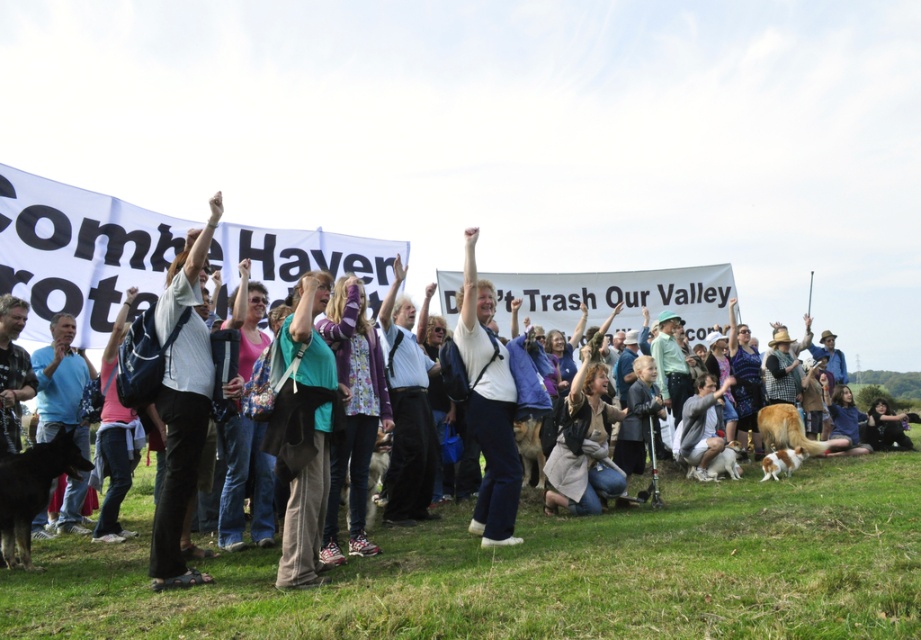
You are a photographer at the protest and need to capture a photo that includes both the light gray cotton shirt at center and the blue cotton shirt at left. Which shirt should you position closer to the camera to ensure both are fully visible in the frame?

You should position the light gray cotton shirt at center closer to the camera because it is narrower than the blue cotton shirt at left, allowing both to fit within the frame while maintaining visibility.

You are a photographer trying to capture the protest scene. You notice two people in the crowd wearing white cotton shirt at center and light gray cotton shirt at center. Which participant is shorter in height?

The white cotton shirt at center has a lesser height compared to the light gray cotton shirt at center, so the participant wearing the white cotton shirt at center is shorter.

You are a photographer standing at the edge of the protest field. You want to take a photo of the light gray cotton shirt at center and the white matte jacket at center. If your camera can focus on objects within 7 feet, will both subjects be in focus?

The light gray cotton shirt at center is 8.03 feet away from the white matte jacket at center. Since the camera can focus within 7 feet, the distance between them exceeds the focus range, so both subjects cannot be in focus simultaneously.